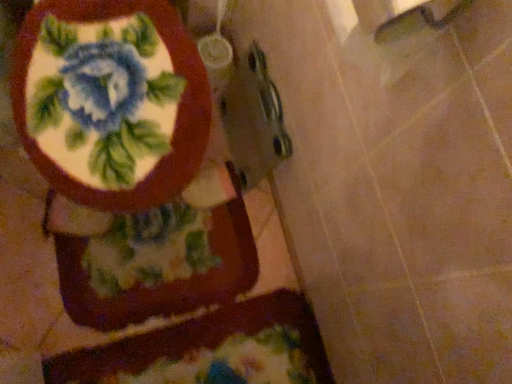
Question: From a real-world perspective, relative to fluffy multicolored bath mat at lower center, is matte ceramic toilet at upper left vertically above or below?

Choices:
 (A) below
 (B) above

Answer: (B)

Question: Is matte ceramic toilet at upper left situated inside fluffy multicolored bath mat at lower center or outside?

Choices:
 (A) inside
 (B) outside

Answer: (B)

Question: In terms of size, does matte ceramic toilet at upper left appear bigger or smaller than fluffy multicolored bath mat at lower center?

Choices:
 (A) small
 (B) big

Answer: (B)

Question: Considering the positions of fluffy multicolored bath mat at lower center and matte ceramic toilet at upper left in the image, is fluffy multicolored bath mat at lower center wider or thinner than matte ceramic toilet at upper left?

Choices:
 (A) thin
 (B) wide

Answer: (A)

Question: Does point (302, 314) appear closer or farther from the camera than point (205, 74)?

Choices:
 (A) closer
 (B) farther

Answer: (B)

Question: Is fluffy multicolored bath mat at lower center to the left or to the right of matte ceramic toilet at upper left in the image?

Choices:
 (A) right
 (B) left

Answer: (A)

Question: Is fluffy multicolored bath mat at lower center situated inside matte ceramic toilet at upper left or outside?

Choices:
 (A) outside
 (B) inside

Answer: (A)